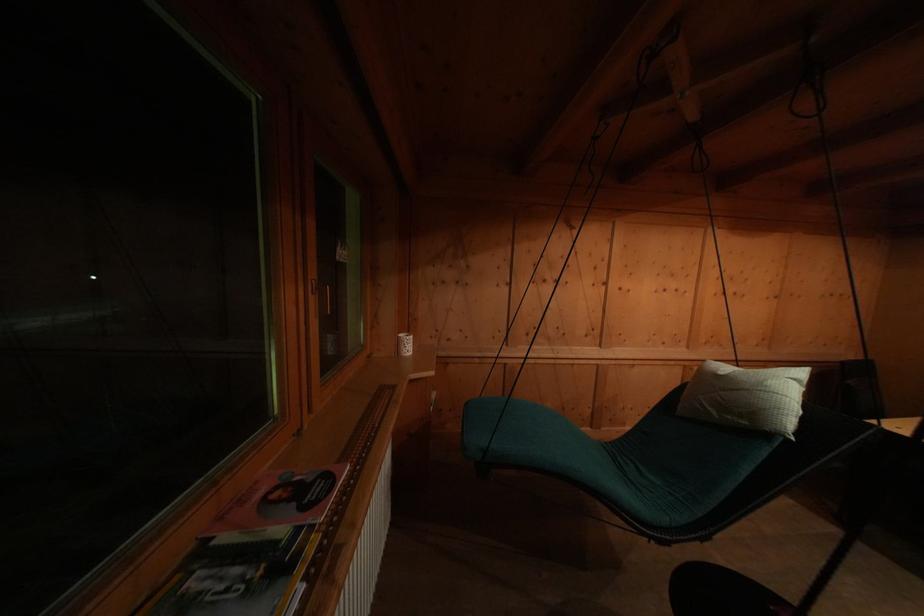
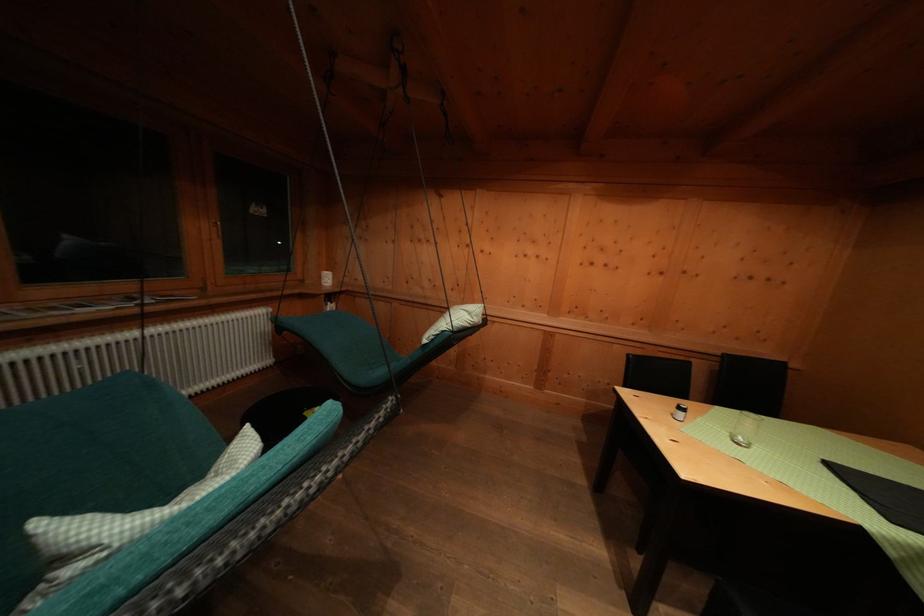
Question: In a continuous first-person perspective shot, in which direction is the camera moving?

Choices:
 (A) Left
 (B) Right
 (C) Forward
 (D) Backward

Answer: (B)